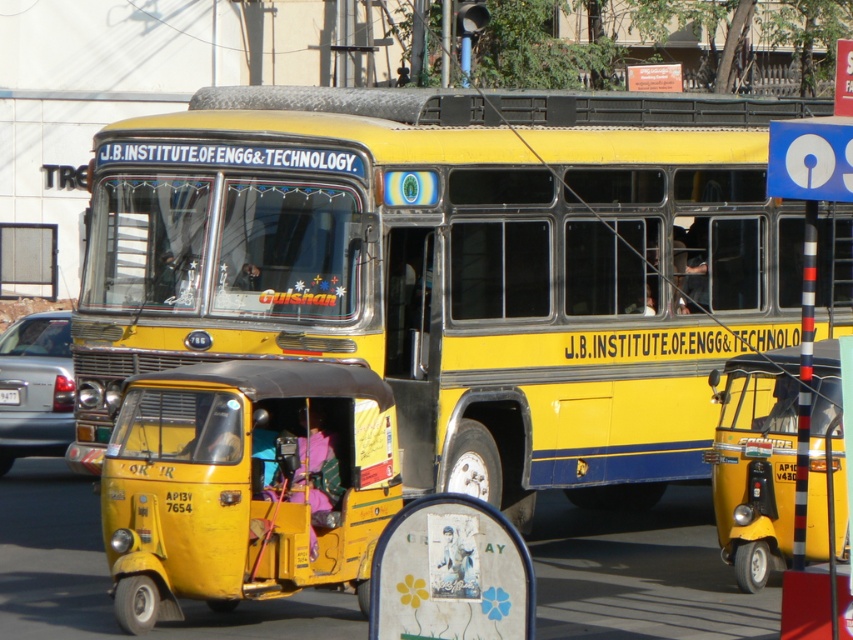
Question: Is yellow matte bus at center further to camera compared to yellow plastic license plate at center?

Choices:
 (A) no
 (B) yes

Answer: (A)

Question: Estimate the real-world distances between objects in this image. Which object is farther from the metallic silver sedan at left?

Choices:
 (A) yellow matte bus at center
 (B) yellow plastic license plate at center
 (C) yellow matte taxi at lower left

Answer: (C)

Question: Estimate the real-world distances between objects in this image. Which object is farther from the metallic silver sedan at left?

Choices:
 (A) yellow matte bus at center
 (B) yellow plastic license plate at center

Answer: (A)

Question: Which of the following is the farthest from the observer?

Choices:
 (A) yellow matte auto-rickshaw at right
 (B) yellow matte taxi at lower left
 (C) yellow matte bus at center
 (D) metallic silver sedan at left

Answer: (D)

Question: Does yellow matte taxi at lower left lie in front of yellow plastic license plate at center?

Choices:
 (A) yes
 (B) no

Answer: (A)

Question: Is yellow matte bus at center below yellow plastic license plate at center?

Choices:
 (A) no
 (B) yes

Answer: (A)